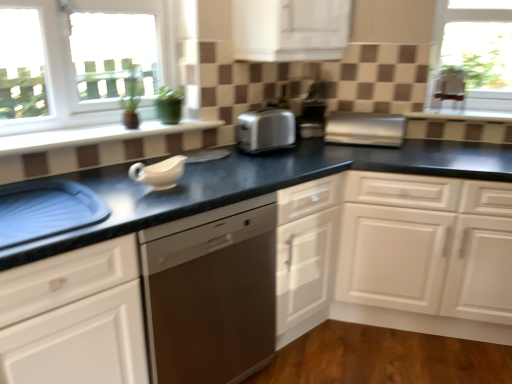
I want to click on vacant area on top of stainless steel dishwasher at center (from a real-world perspective), so click(190, 186).